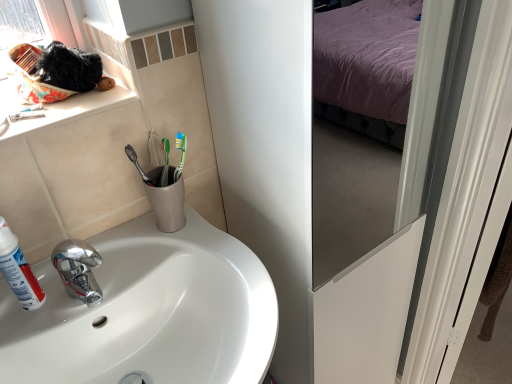
Question: From the image's perspective, relative to white glossy sink at lower left, is white matte shaving cream at left above or below?

Choices:
 (A) below
 (B) above

Answer: (B)

Question: In terms of size, does white matte shaving cream at left appear bigger or smaller than white glossy sink at lower left?

Choices:
 (A) big
 (B) small

Answer: (B)

Question: Is white matte shaving cream at left inside the boundaries of white glossy sink at lower left, or outside?

Choices:
 (A) inside
 (B) outside

Answer: (B)

Question: From the image's perspective, is white glossy sink at lower left above or below white matte shaving cream at left?

Choices:
 (A) below
 (B) above

Answer: (A)

Question: Considering the positions of point (3, 357) and point (30, 304), is point (3, 357) closer or farther from the camera than point (30, 304)?

Choices:
 (A) closer
 (B) farther

Answer: (A)

Question: In terms of height, does white glossy sink at lower left look taller or shorter compared to white matte shaving cream at left?

Choices:
 (A) tall
 (B) short

Answer: (A)

Question: Is white glossy sink at lower left situated inside white matte shaving cream at left or outside?

Choices:
 (A) outside
 (B) inside

Answer: (A)